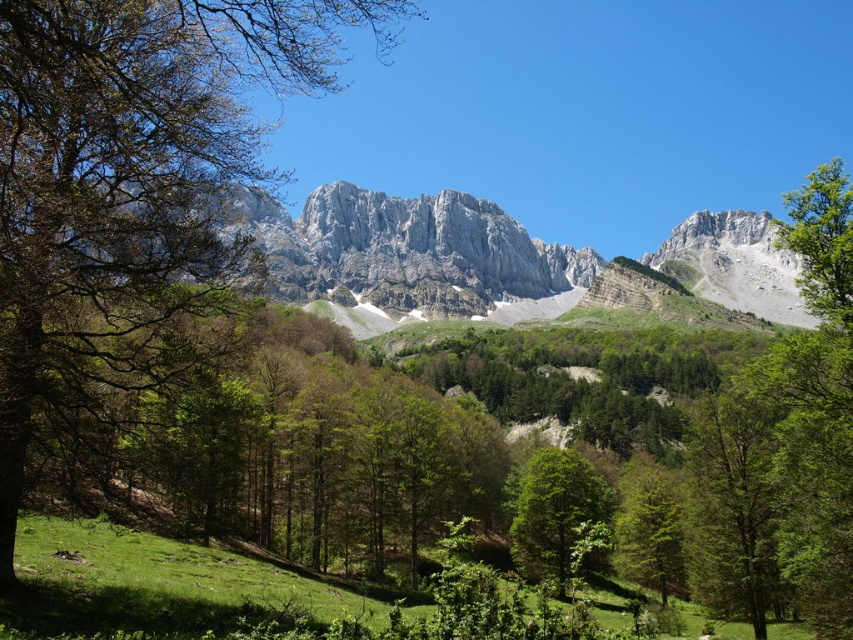
You are standing in the meadow and want to take a photo of both the green leafy tree at left and the green leafy tree at lower right in the same frame. Which tree should you position closer to you to ensure both are fully visible?

To include both the green leafy tree at left and the green leafy tree at lower right in the same frame, you should position yourself closer to the green leafy tree at lower right since it is shorter than the green leafy tree at left. This adjustment will help balance their sizes in the photo, ensuring both are fully visible.

You are a hiker standing in the meadow and want to take a photo that includes both the green leafy tree at left and the green leafy tree at center. Which tree should you position closer to the edge of the frame to ensure both are fully visible?

The green leafy tree at left might be wider than the green leafy tree at center, so you should position the wider tree closer to the edge of the frame to ensure both are fully visible.